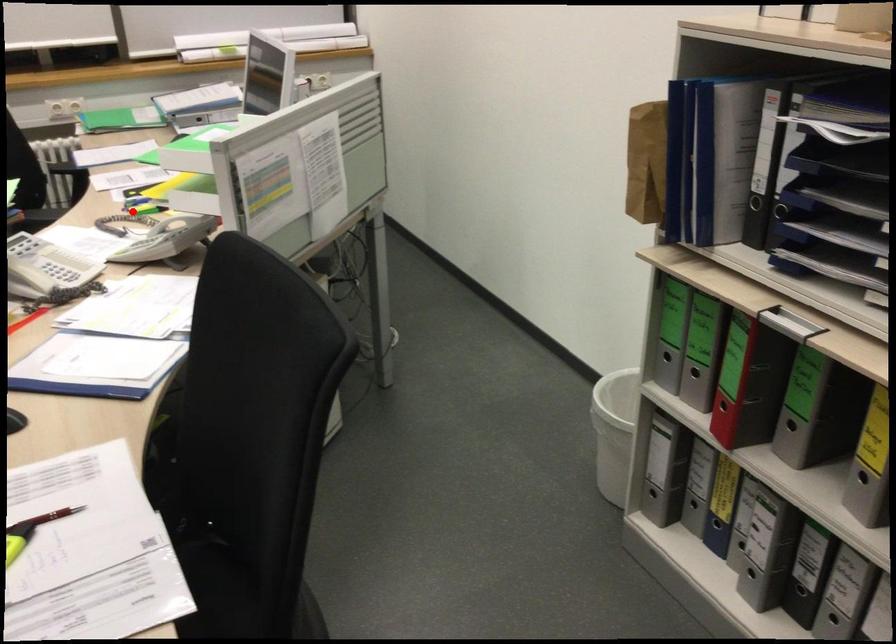
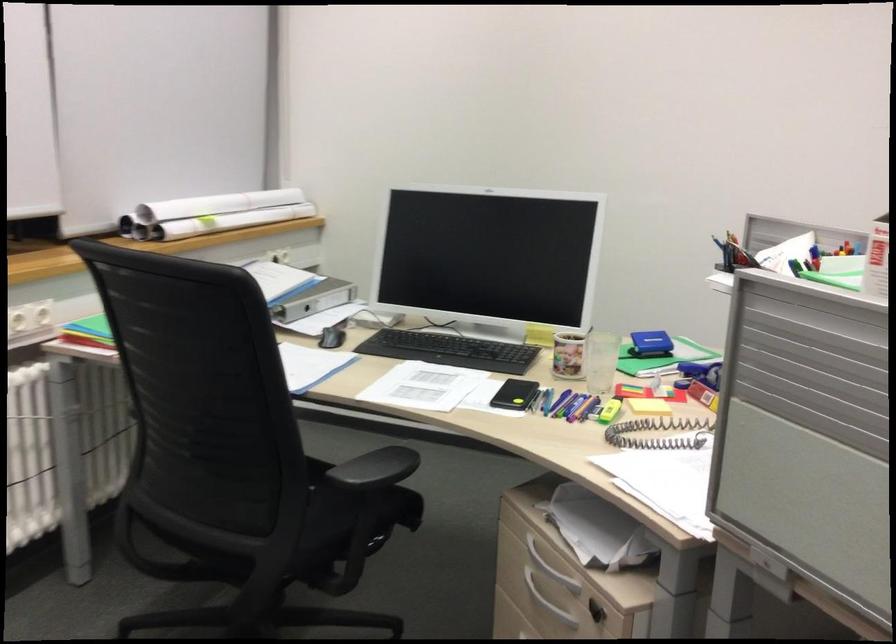
Where in the second image is the point corresponding to the highlighted location from the first image?

(609, 411)